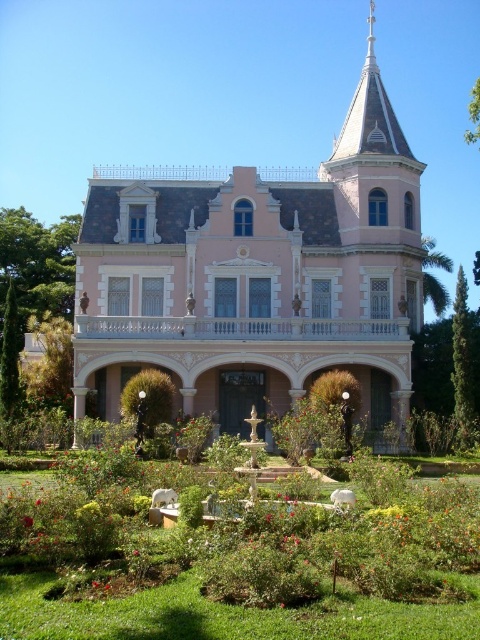
Can you confirm if pink wood mansion at center is wider than green leafy bushes at center?

Yes, pink wood mansion at center is wider than green leafy bushes at center.

Can you confirm if pink wood mansion at center is positioned to the right of green leafy bushes at center?

Yes, pink wood mansion at center is to the right of green leafy bushes at center.

Between point (386, 292) and point (168, 632), which one is positioned in front?

Positioned in front is point (168, 632).

Identify the location of pink wood mansion at center. (257, 276).

Does pink wood mansion at center appear under smooth red rose at center?

Incorrect, pink wood mansion at center is not positioned below smooth red rose at center.

Which of these two, pink wood mansion at center or smooth red rose at center, stands taller?

pink wood mansion at center is taller.

Is point (331, 324) in front of point (23, 516)?

No, (331, 324) is further to viewer.

Locate an element on the screen. Image resolution: width=480 pixels, height=640 pixels. pink wood mansion at center is located at coordinates (257, 276).

Who is positioned more to the left, green leafy bushes at center or smooth red rose at center?

Positioned to the left is smooth red rose at center.

Can you confirm if green leafy bushes at center is positioned below smooth red rose at center?

Indeed, green leafy bushes at center is positioned under smooth red rose at center.

The height and width of the screenshot is (640, 480). What do you see at coordinates (256, 545) in the screenshot?
I see `green leafy bushes at center` at bounding box center [256, 545].

Identify the location of green leafy bushes at center. The height and width of the screenshot is (640, 480). [256, 545].